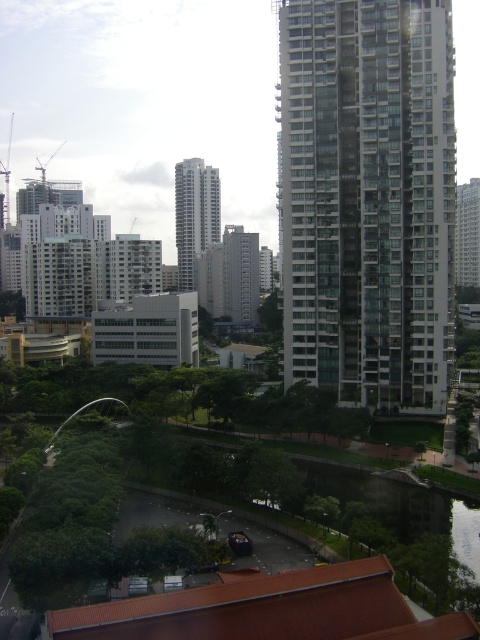
Question: Which point is farther to the camera?

Choices:
 (A) glassy reflective skyscraper at center
 (B) glassy white building at right
 (C) white glassy tower at center

Answer: (C)

Question: Does glassy white building at right lie in front of white glassy tower at center?

Choices:
 (A) no
 (B) yes

Answer: (B)

Question: Which point appears closest to the camera in this image?

Choices:
 (A) 181,284
 (B) 288,273

Answer: (B)

Question: Does glassy white building at right have a greater width compared to white glassy tower at center?

Choices:
 (A) yes
 (B) no

Answer: (A)

Question: From the image, what is the correct spatial relationship of glassy white building at right in relation to glassy reflective skyscraper at center?

Choices:
 (A) left
 (B) right

Answer: (A)

Question: Which object appears farthest from the camera in this image?

Choices:
 (A) white glassy tower at center
 (B) glassy reflective skyscraper at center
 (C) glassy white building at right

Answer: (A)